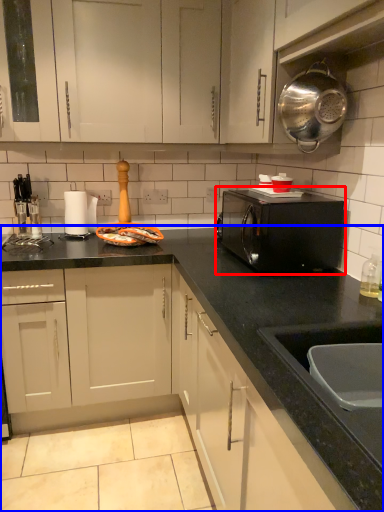
Question: Which object appears farthest to the camera in this image, home appliance (highlighted by a red box) or countertop (highlighted by a blue box)?

Choices:
 (A) home appliance
 (B) countertop

Answer: (B)